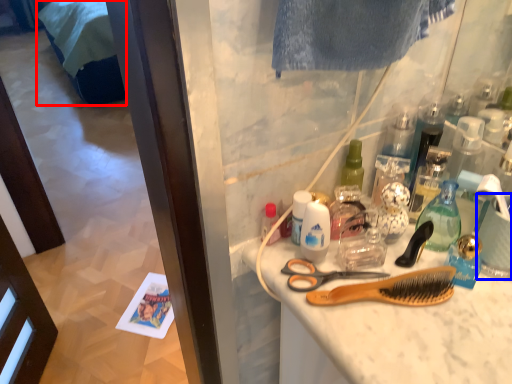
Question: Which point is closer to the camera, bed (highlighted by a red box) or coffee cup (highlighted by a blue box)?

Choices:
 (A) bed
 (B) coffee cup

Answer: (B)